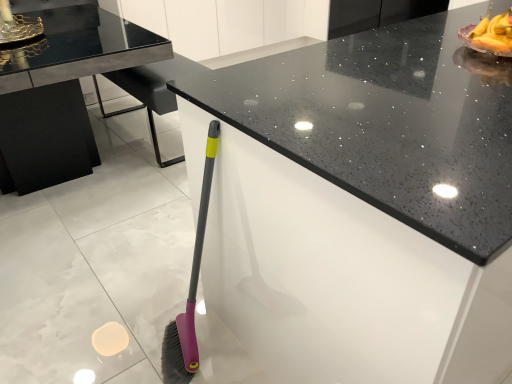
Question: Based on their positions, is black speckled granite countertop at center located to the left or right of black glass table at upper left?

Choices:
 (A) left
 (B) right

Answer: (B)

Question: Is black speckled granite countertop at center wider or thinner than black glass table at upper left?

Choices:
 (A) wide
 (B) thin

Answer: (B)

Question: Is black speckled granite countertop at center in front of or behind black glass table at upper left in the image?

Choices:
 (A) behind
 (B) front

Answer: (B)

Question: Considering their positions, is black glass table at upper left located in front of or behind black speckled granite countertop at center?

Choices:
 (A) behind
 (B) front

Answer: (A)

Question: In the image, is black glass table at upper left on the left side or the right side of black speckled granite countertop at center?

Choices:
 (A) right
 (B) left

Answer: (B)

Question: Based on their sizes in the image, would you say black glass table at upper left is bigger or smaller than black speckled granite countertop at center?

Choices:
 (A) big
 (B) small

Answer: (B)

Question: Considering the positions of black glass table at upper left and black speckled granite countertop at center in the image, is black glass table at upper left taller or shorter than black speckled granite countertop at center?

Choices:
 (A) tall
 (B) short

Answer: (B)